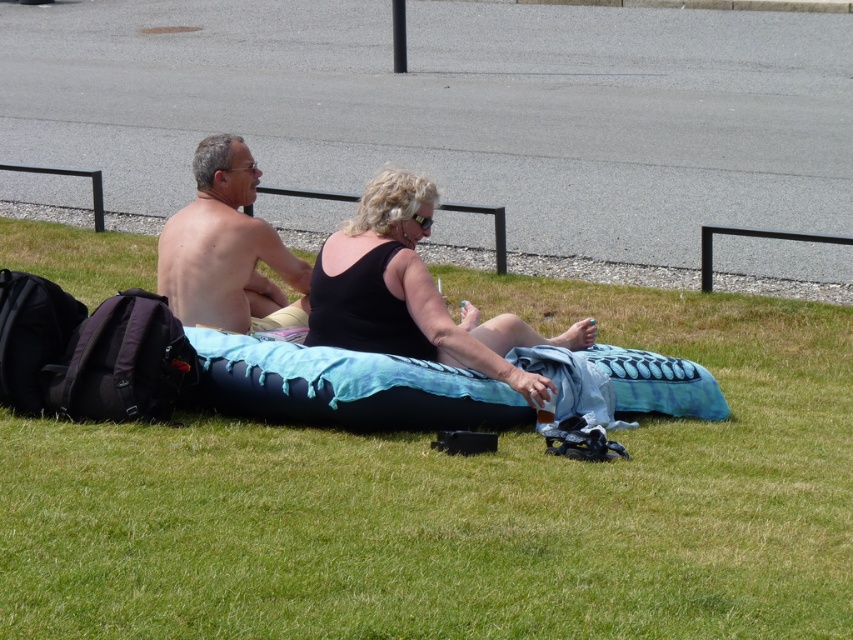
You are a photographer wanting to capture a candid shot of both the black matte tank top at center and the skinny shirtless man at center. Since the tank top is under the man, where should you position your camera to ensure both are visible in the frame?

Position the camera slightly above the level of the skinny shirtless man at center so that you can look down and see both the black matte tank top at center underneath him and his upper body in the same frame.

You are planning to place a picnic basket between the green grassy at center and the black matte tank top at center. Given that the basket requires 3 feet of space, will there be enough room?

The distance between the green grassy at center and the black matte tank top at center is 8.51 feet, so yes, placing a picnic basket requiring 3 feet of space between them is feasible as there is sufficient space available.

You are a photographer trying to capture a candid shot of the two people on the inflatable pool float. You notice the black matte tank top at center and the skinny shirtless man at center. Which of the two has a wider torso?

The black matte tank top at center is wider than the skinny shirtless man at center, so the black matte tank top at center has a wider torso.